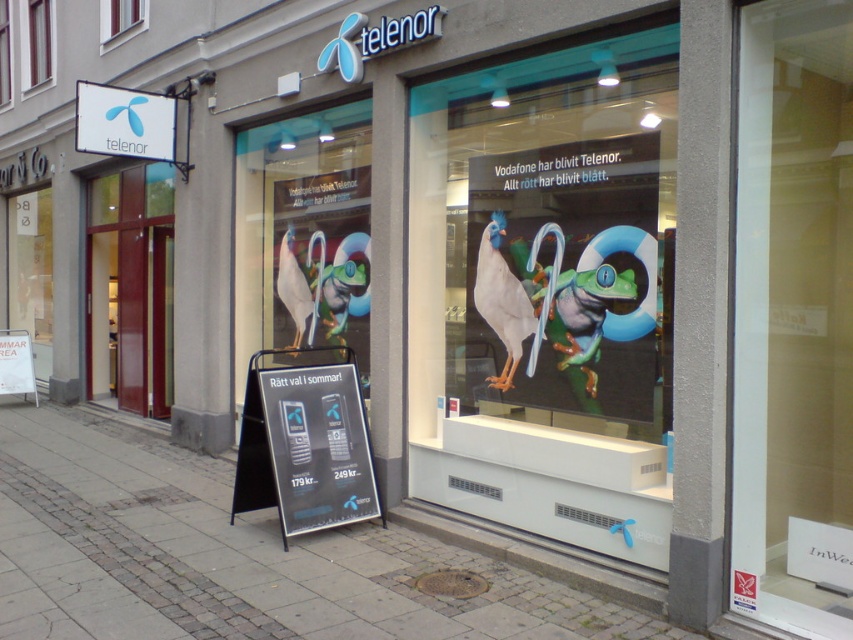
Who is positioned more to the right, metallic silver phone at center or transparent glass window at upper center?

From the viewer's perspective, metallic silver phone at center appears more on the right side.

Which is in front, point (361, 404) or point (10, 92)?

Point (361, 404)

Is point (271, 408) closer to viewer compared to point (4, 65)?

Yes, it is.

Image resolution: width=853 pixels, height=640 pixels. Identify the location of metallic silver phone at center. (317, 445).

Between gray concrete pavement at lower center and transparent glass window at upper center, which one is positioned lower?

gray concrete pavement at lower center is lower down.

Can you confirm if gray concrete pavement at lower center is smaller than transparent glass window at upper center?

Yes, gray concrete pavement at lower center is smaller than transparent glass window at upper center.

Which is in front, point (71, 600) or point (9, 36)?

Point (71, 600) is in front.

Find the location of a particular element. The image size is (853, 640). gray concrete pavement at lower center is located at coordinates (233, 557).

Between metallic silver phone at center and wooden frame at upper left, which one has less height?

With less height is metallic silver phone at center.

Does metallic silver phone at center appear on the left side of wooden frame at upper left?

Incorrect, metallic silver phone at center is not on the left side of wooden frame at upper left.

Does point (350, 467) come in front of point (28, 38)?

Yes, point (350, 467) is closer to viewer.

Locate an element on the screen. This screenshot has width=853, height=640. metallic silver phone at center is located at coordinates (317, 445).